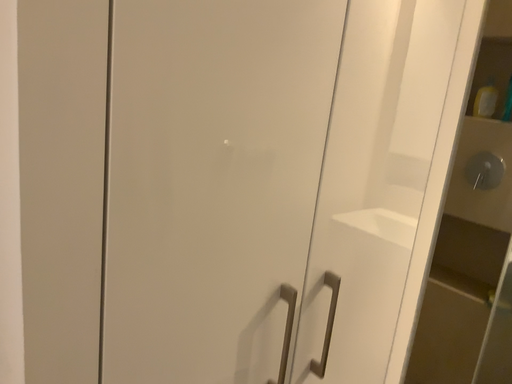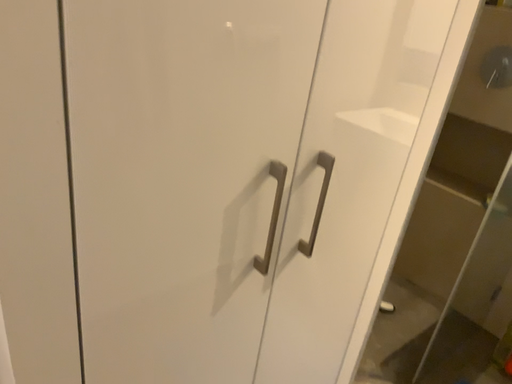
Question: How did the camera likely rotate when shooting the video?

Choices:
 (A) rotated downward
 (B) rotated upward

Answer: (A)